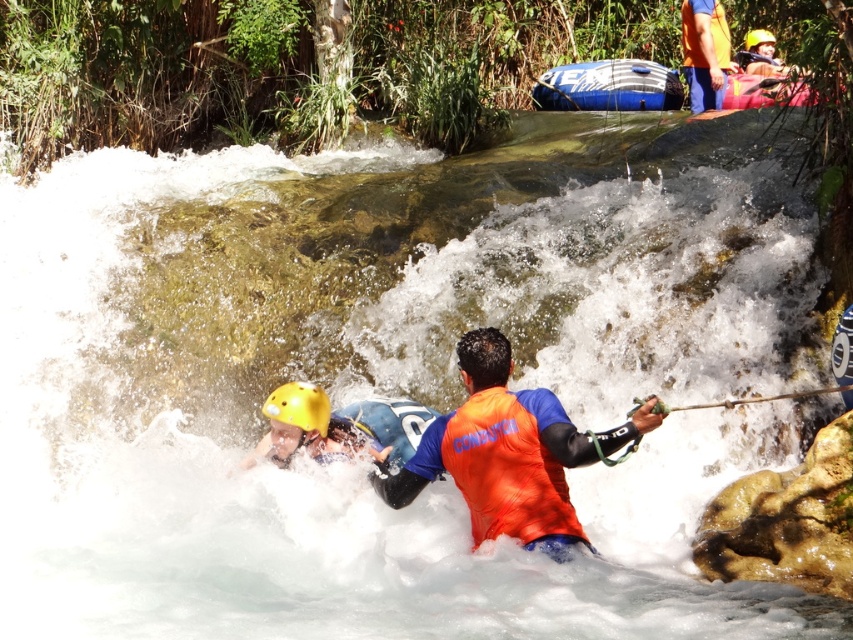
Question: Is the position of orange fabric life vest at center more distant than that of orange fabric life jacket at center?

Choices:
 (A) no
 (B) yes

Answer: (A)

Question: Can you confirm if orange fabric life vest at upper center is positioned to the right of smooth black paddle at center?

Choices:
 (A) yes
 (B) no

Answer: (A)

Question: Which point is closer to the camera?

Choices:
 (A) (421, 444)
 (B) (263, 404)

Answer: (A)

Question: Where is blue rubber kayak at upper center located in relation to yellow matte helmet at upper center in the image?

Choices:
 (A) above
 (B) below

Answer: (B)

Question: Which object is farther from the camera taking this photo?

Choices:
 (A) orange fabric life vest at center
 (B) orange fabric life jacket at center
 (C) smooth black paddle at center

Answer: (C)

Question: Considering the real-world distances, which object is farthest from the yellow matte helmet at upper center?

Choices:
 (A) smooth black paddle at center
 (B) blue inflatable kayak at upper center
 (C) yellow matte helmet at lower left
 (D) orange fabric life vest at upper center

Answer: (C)